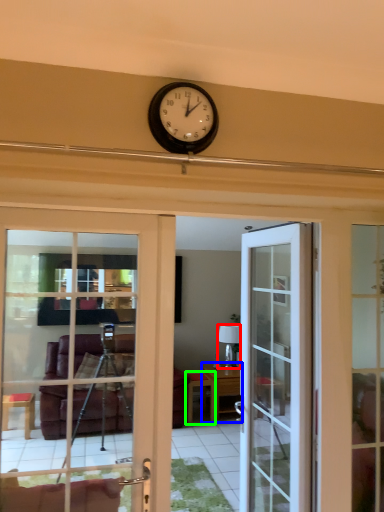
Question: Which object is the closest to the lamp (highlighted by a red box)? Choose among these: table (highlighted by a blue box) or table (highlighted by a green box).

Choices:
 (A) table
 (B) table

Answer: (A)